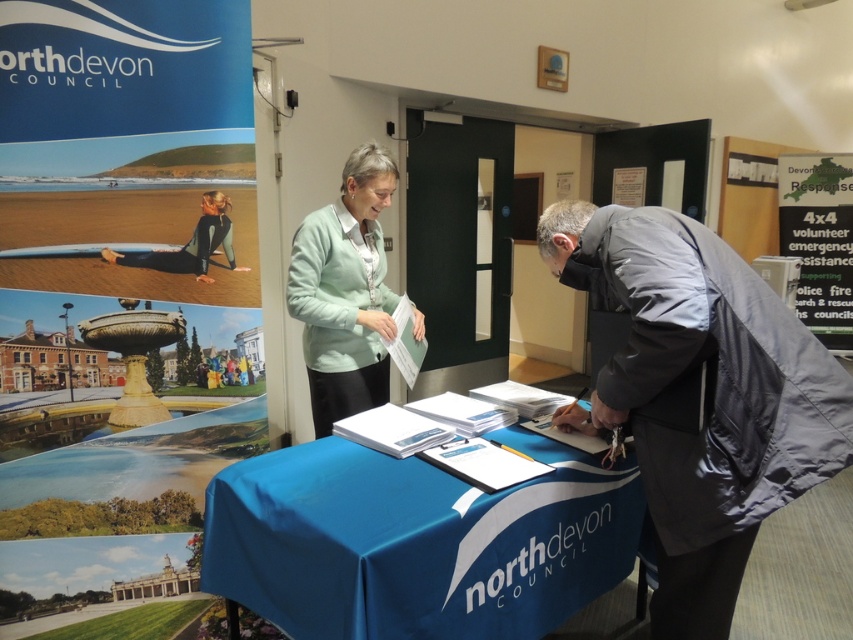
You are a customer at a northdevon COUNCIL event. You see the light blue fabric tablecloth at center and the green paper at upper right. Which object is closer to the left side of the table?

The light blue fabric tablecloth at center is closer to the left side of the table than the green paper at upper right.

You are a customer at the northdevon COUNCIL table. You see a light green fabric at center and a green paper at upper right. Which item is closer to you?

The light green fabric at center is closer to you because it is in front of the green paper at upper right.

You are a customer standing at the table and need to reach the green paper at upper right to sign a document. The table has a light blue fabric tablecloth at center. Considering the distance between them, can you comfortably reach from the tablecloth to the green paper without moving your chair?

The light blue fabric tablecloth at center is 5.57 meters from the green paper at upper right. This distance is too large for a person to comfortably reach without moving their chair, so you would need to adjust your position.